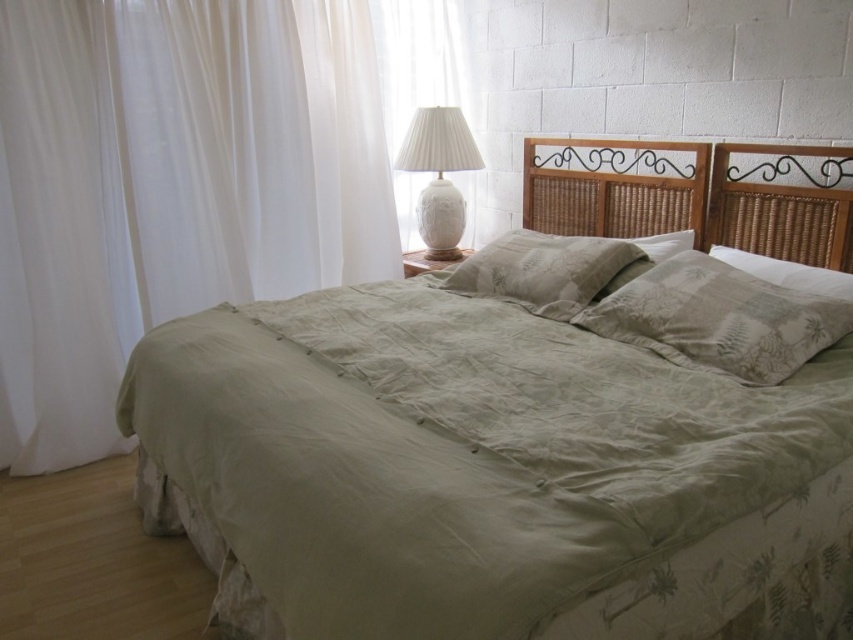
Consider the image. You are designing a layout for a bedroom and have to place a large decorative item between the woven wood headboard at upper right and the sage green fabric pillow at center. Considering their sizes, which object would be more suitable to place next to the smaller one?

The woven wood headboard at upper right is smaller than the sage green fabric pillow at center, so placing the large decorative item next to the sage green fabric pillow at center would leave enough space for both items without overcrowding the smaller headboard.